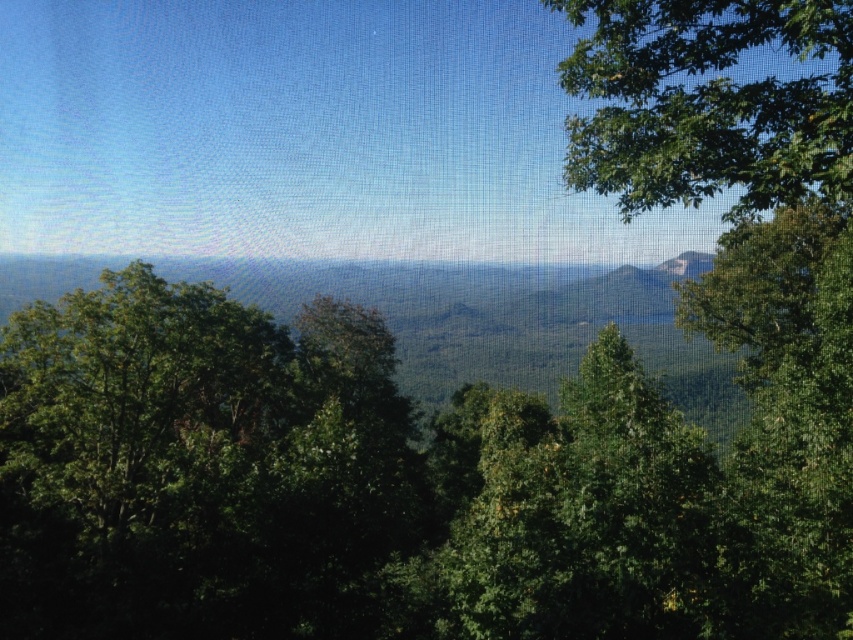
Who is positioned more to the left, green leafy tree at right or green mossy rock at upper right?

green leafy tree at right is more to the left.

Can you confirm if green leafy tree at right is bigger than green mossy rock at upper right?

Yes.

Identify the location of green leafy tree at right. The height and width of the screenshot is (640, 853). (785, 417).

Between green leafy tree at upper right and green mossy rock at upper right, which one has less height?

green mossy rock at upper right

Is green leafy tree at upper right shorter than green mossy rock at upper right?

Incorrect, green leafy tree at upper right's height does not fall short of green mossy rock at upper right's.

Where is `green leafy tree at upper right`? The width and height of the screenshot is (853, 640). green leafy tree at upper right is located at coordinates (708, 104).

Find the location of a particular element. green leafy tree at upper right is located at coordinates (708, 104).

Consider the image. Does green leafy tree at right have a larger size compared to green leafy tree at upper right?

No, green leafy tree at right is not bigger than green leafy tree at upper right.

This screenshot has width=853, height=640. What do you see at coordinates (785, 417) in the screenshot? I see `green leafy tree at right` at bounding box center [785, 417].

Where is `green leafy tree at right`? green leafy tree at right is located at coordinates (785, 417).